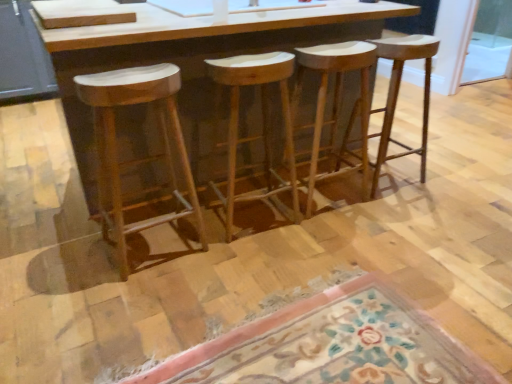
Find the location of a particular element. free space to the right of natural wood stool at center, the 1th stool from the right is located at coordinates (434, 182).